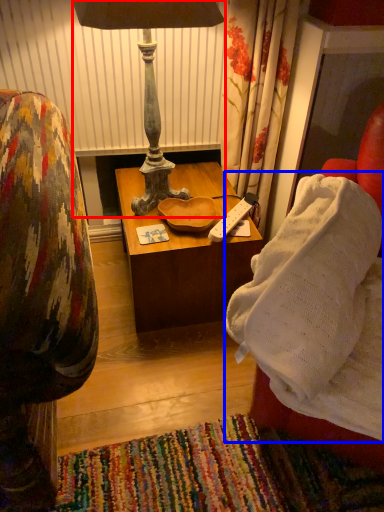
Question: Among these objects, which one is nearest to the camera, lamp (highlighted by a red box) or blanket (highlighted by a blue box)?

Choices:
 (A) lamp
 (B) blanket

Answer: (B)